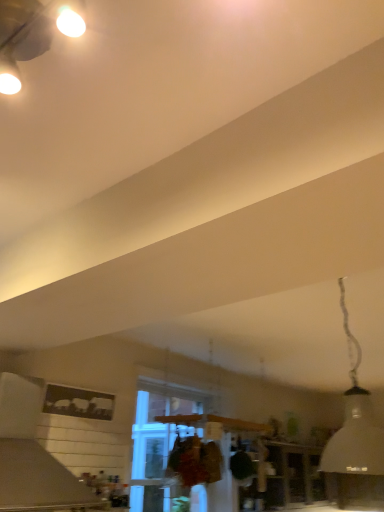
Question: Is white matte vent at upper left behind white matte lampshade at upper right?

Choices:
 (A) yes
 (B) no

Answer: (A)

Question: Can you confirm if white matte vent at upper left is smaller than white matte lampshade at upper right?

Choices:
 (A) yes
 (B) no

Answer: (B)

Question: Is white matte lampshade at upper right at the back of white matte vent at upper left?

Choices:
 (A) no
 (B) yes

Answer: (A)

Question: From the image's perspective, would you say white matte vent at upper left is positioned over white matte lampshade at upper right?

Choices:
 (A) no
 (B) yes

Answer: (A)

Question: Is white matte vent at upper left with white matte lampshade at upper right?

Choices:
 (A) yes
 (B) no

Answer: (B)

Question: Choose the correct answer: Is clear glass window at center inside white matte vent at upper left or outside it?

Choices:
 (A) outside
 (B) inside

Answer: (A)

Question: Is clear glass window at center in front of or behind white matte vent at upper left in the image?

Choices:
 (A) behind
 (B) front

Answer: (A)

Question: Considering the positions of point (155, 420) and point (16, 415), is point (155, 420) closer or farther from the camera than point (16, 415)?

Choices:
 (A) closer
 (B) farther

Answer: (B)

Question: Visually, is clear glass window at center positioned to the left or to the right of white matte vent at upper left?

Choices:
 (A) right
 (B) left

Answer: (A)

Question: Is white matte vent at upper left bigger or smaller than clear glass window at center?

Choices:
 (A) big
 (B) small

Answer: (B)

Question: Considering the positions of white matte vent at upper left and clear glass window at center in the image, is white matte vent at upper left taller or shorter than clear glass window at center?

Choices:
 (A) short
 (B) tall

Answer: (A)

Question: Is white matte vent at upper left in front of or behind clear glass window at center in the image?

Choices:
 (A) front
 (B) behind

Answer: (A)

Question: From the image's perspective, is white matte vent at upper left above or below clear glass window at center?

Choices:
 (A) below
 (B) above

Answer: (B)

Question: In terms of width, does white matte lampshade at upper right look wider or thinner when compared to clear glass window at center?

Choices:
 (A) wide
 (B) thin

Answer: (A)

Question: Based on their positions, is white matte lampshade at upper right located to the left or right of clear glass window at center?

Choices:
 (A) right
 (B) left

Answer: (A)